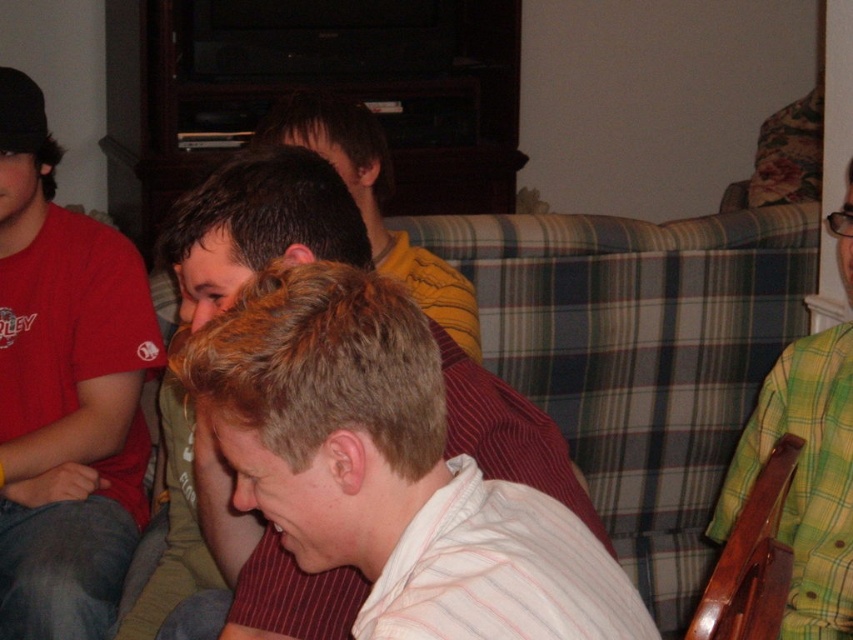
Is matte red t-shirt at left to the right of green plaid shirt at right from the viewer's perspective?

No, matte red t-shirt at left is not to the right of green plaid shirt at right.

Who is more distant from viewer, (85, 282) or (839, 369)?

Point (85, 282)

I want to click on matte red t-shirt at left, so click(65, 392).

Can you confirm if matte red t-shirt at left is bigger than light brown striped shirt at center?

Incorrect, matte red t-shirt at left is not larger than light brown striped shirt at center.

From the picture: How much distance is there between matte red t-shirt at left and light brown striped shirt at center?

A distance of 17.26 inches exists between matte red t-shirt at left and light brown striped shirt at center.

Locate an element on the screen. matte red t-shirt at left is located at coordinates (65, 392).

Who is positioned more to the right, light brown striped shirt at center or green plaid shirt at right?

Positioned to the right is green plaid shirt at right.

Which is behind, point (312, 195) or point (814, 440)?

The point (814, 440) is more distant.

Identify the location of light brown striped shirt at center. The height and width of the screenshot is (640, 853). (257, 227).